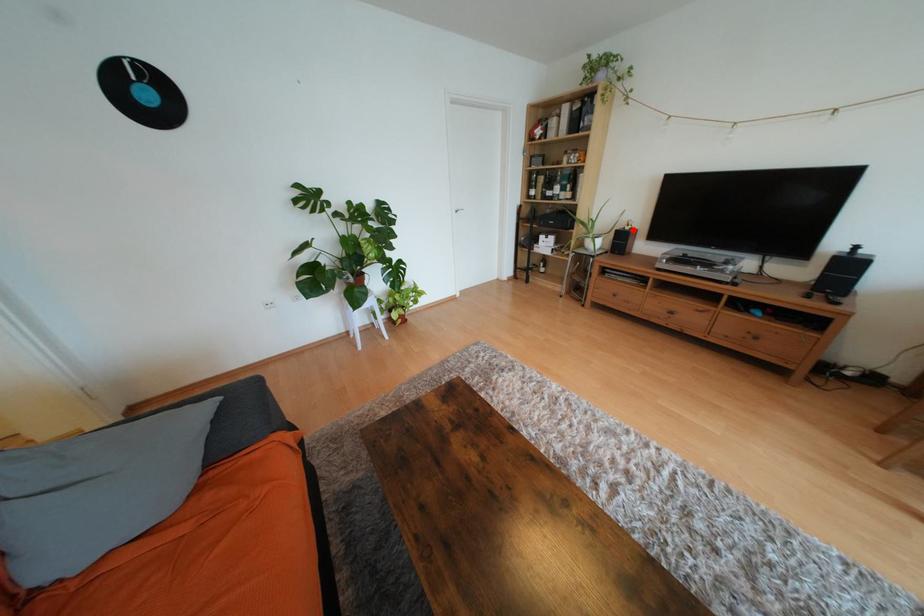
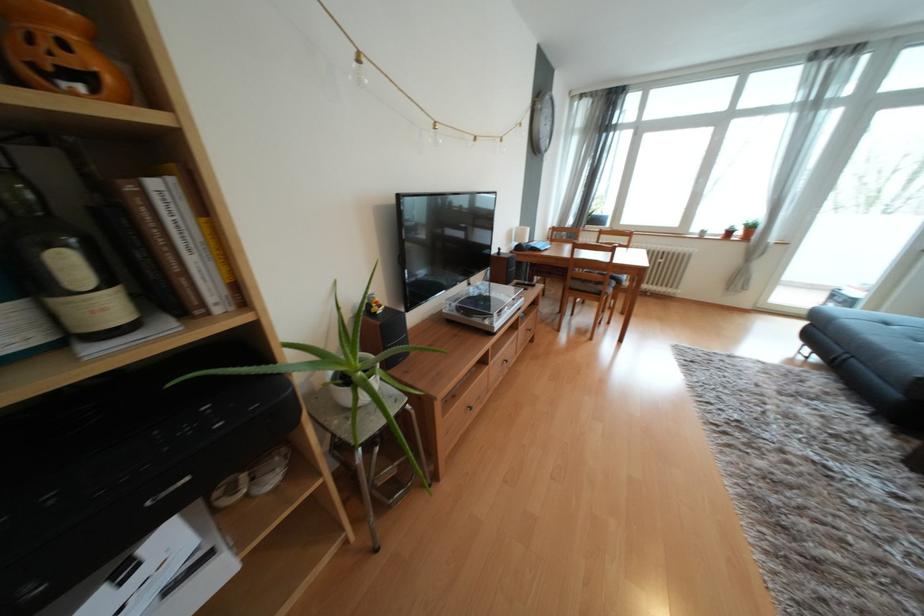
The point at the highlighted location is marked in the first image. Where is the corresponding point in the second image?

(385, 312)